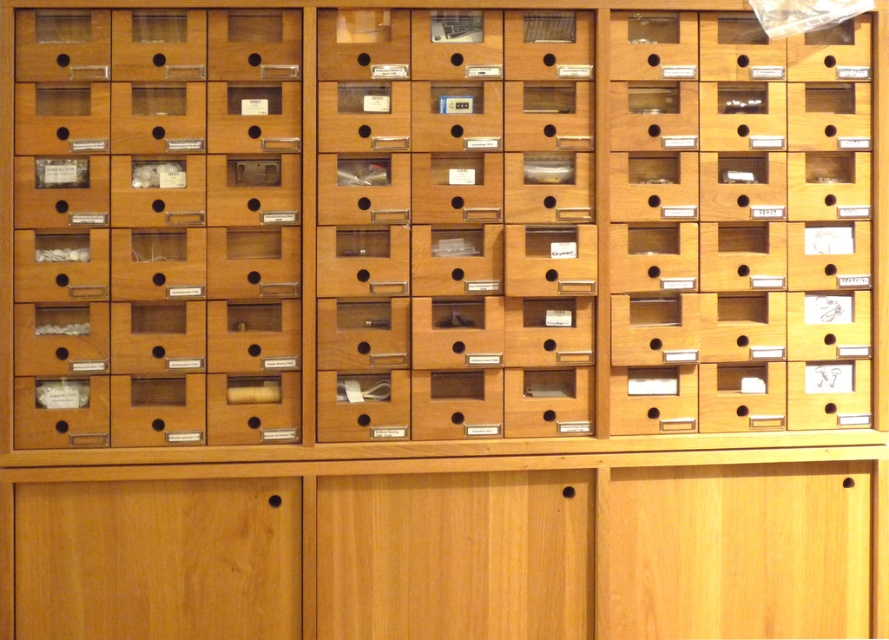
Question: Estimate the real-world distances between objects in this image. Which object is closer to the wooden drawer at center?

Choices:
 (A) wooden drawer at left
 (B) wooden drawer at right

Answer: (B)

Question: Does wooden drawer at left come in front of wooden drawer at right?

Choices:
 (A) yes
 (B) no

Answer: (A)

Question: Which of the following is the closest to the observer?

Choices:
 (A) (834, 195)
 (B) (581, 170)

Answer: (B)

Question: Is wooden drawer at left positioned in front of wooden drawer at right?

Choices:
 (A) no
 (B) yes

Answer: (B)

Question: Which point is closer to the camera taking this photo?

Choices:
 (A) (497, 282)
 (B) (196, 84)

Answer: (B)

Question: Is wooden drawer at left positioned before wooden drawer at right?

Choices:
 (A) yes
 (B) no

Answer: (A)